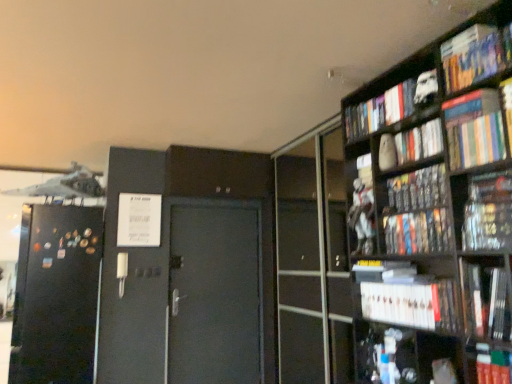
This screenshot has height=384, width=512. In order to click on hardcover book at lower right, positioned as the 11th book in top-to-bottom order in this screenshot , I will do click(x=444, y=371).

Locate an element on the screen. The height and width of the screenshot is (384, 512). metallic silver figure at upper right, the 6th book from the bottom is located at coordinates (362, 208).

Image resolution: width=512 pixels, height=384 pixels. What do you see at coordinates (417, 190) in the screenshot? I see `matte black book at upper right, the 7th book in the bottom-to-top sequence` at bounding box center [417, 190].

This screenshot has height=384, width=512. What are the coordinates of `white matte bookshelf at lower right, which is counted as the tenth book, starting from the top` in the screenshot? It's located at (406, 296).

What do you see at coordinates (406, 296) in the screenshot? The height and width of the screenshot is (384, 512). I see `white matte bookshelf at lower right, the 2th book ordered from the bottom` at bounding box center [406, 296].

The height and width of the screenshot is (384, 512). Describe the element at coordinates (475, 55) in the screenshot. I see `hardcover book at upper right, which is counted as the first book, starting from the top` at that location.

The height and width of the screenshot is (384, 512). Find the location of `white matte book at upper right, positioned as the ninth book in bottom-to-top order`. white matte book at upper right, positioned as the ninth book in bottom-to-top order is located at coordinates (410, 145).

Image resolution: width=512 pixels, height=384 pixels. Find the location of `white glossy book at lower right, the ninth book when ordered from top to bottom`. white glossy book at lower right, the ninth book when ordered from top to bottom is located at coordinates (486, 301).

From a real-world perspective, is white matte bookshelf at lower right, which is counted as the tenth book, starting from the top, above or below white matte figurine at upper right, which ranks as the tenth book in bottom-to-top order?

In terms of real-world spatial position, white matte bookshelf at lower right, which is counted as the tenth book, starting from the top, is below white matte figurine at upper right, which ranks as the tenth book in bottom-to-top order.

Is point (445, 325) closer or farther from the camera than point (406, 95)?

Point (445, 325).

Is white matte figurine at upper right, which ranks as the tenth book in bottom-to-top order, inside white matte bookshelf at lower right, which is counted as the tenth book, starting from the top?

No.

From a real-world perspective, is hardcover book at lower right, the first book positioned from the bottom, over white matte figurine at upper right, which ranks as the tenth book in bottom-to-top order?

Incorrect, from a real-world perspective, hardcover book at lower right, the first book positioned from the bottom, is lower than white matte figurine at upper right, which ranks as the tenth book in bottom-to-top order.

Can you tell me how much hardcover book at lower right, the first book positioned from the bottom, and white matte figurine at upper right, the 2th book from the top, differ in facing direction?

0.0184 degrees.

Are hardcover book at lower right, positioned as the 11th book in top-to-bottom order, and white matte figurine at upper right, which ranks as the tenth book in bottom-to-top order, beside each other?

No, hardcover book at lower right, positioned as the 11th book in top-to-bottom order, is not beside white matte figurine at upper right, which ranks as the tenth book in bottom-to-top order.

Is point (457, 379) closer or farther from the camera than point (419, 76)?

Point (457, 379) is positioned closer to the camera compared to point (419, 76).

Are hardcover book at upper right, marked as the 11th book in a bottom-to-top arrangement, and metallic silver figure at upper right, the 6th book from the bottom, far apart?

No.

Where is `the 9th book counting from the right of the metallic silver figure at upper right, the 6th book from the top`? Image resolution: width=512 pixels, height=384 pixels. the 9th book counting from the right of the metallic silver figure at upper right, the 6th book from the top is located at coordinates (475, 55).

Which object is wider, hardcover book at upper right, marked as the 11th book in a bottom-to-top arrangement, or metallic silver figure at upper right, the 6th book from the bottom?

hardcover book at upper right, marked as the 11th book in a bottom-to-top arrangement.

Is metallic silver figure at upper right, the 6th book from the bottom, in front of or behind white matte figurine at upper right, the 2th book from the top, in the image?

In the image, metallic silver figure at upper right, the 6th book from the bottom, appears behind white matte figurine at upper right, the 2th book from the top.

Considering the positions of objects metallic silver figure at upper right, the 6th book from the bottom, and white matte figurine at upper right, which ranks as the tenth book in bottom-to-top order, in the image provided, who is more to the left, metallic silver figure at upper right, the 6th book from the bottom, or white matte figurine at upper right, which ranks as the tenth book in bottom-to-top order,?

metallic silver figure at upper right, the 6th book from the bottom, is more to the left.

From the image's perspective, does metallic silver figure at upper right, the 6th book from the top, appear lower than white matte figurine at upper right, which ranks as the tenth book in bottom-to-top order?

Yes, from the image's perspective, metallic silver figure at upper right, the 6th book from the top, is beneath white matte figurine at upper right, which ranks as the tenth book in bottom-to-top order.

Can we say metallic silver figure at upper right, the 6th book from the bottom, lies outside white matte figurine at upper right, which ranks as the tenth book in bottom-to-top order?

That's correct, metallic silver figure at upper right, the 6th book from the bottom, is outside of white matte figurine at upper right, which ranks as the tenth book in bottom-to-top order.

Is matte black book at upper right, placed as the fifth book when sorted from top to bottom, wider or thinner than white matte book at upper right, which appears as the third book when viewed from the top?

Considering their sizes, matte black book at upper right, placed as the fifth book when sorted from top to bottom, looks broader than white matte book at upper right, which appears as the third book when viewed from the top.

Does point (396, 207) come behind point (402, 147)?

No, (396, 207) is closer to viewer.

From a real-world perspective, is matte black book at upper right, the 7th book in the bottom-to-top sequence, above or below white matte book at upper right, which appears as the third book when viewed from the top?

Clearly, from a real-world perspective, matte black book at upper right, the 7th book in the bottom-to-top sequence, is below white matte book at upper right, which appears as the third book when viewed from the top.

Is hardcover book at upper right, the eighth book from the top, taller or shorter than transparent glass door at right?

Clearly, hardcover book at upper right, the eighth book from the top, is shorter compared to transparent glass door at right.

Is the depth of hardcover book at upper right, the eighth book from the top, greater than that of transparent glass door at right?

No, the depth of hardcover book at upper right, the eighth book from the top, is less than that of transparent glass door at right.

Does hardcover book at upper right, the eighth book from the top, contain transparent glass door at right?

No.

Is transparent glass door at right facing away from hardcover book at upper right, the eighth book from the top?

transparent glass door at right does not have its back to hardcover book at upper right, the eighth book from the top.

Is transparent glass door at right wider than hardcover book at upper right, arranged as the 4th book when ordered from the bottom?

In fact, transparent glass door at right might be narrower than hardcover book at upper right, arranged as the 4th book when ordered from the bottom.

How many degrees apart are the facing directions of transparent glass door at right and hardcover book at upper right, the eighth book from the top?

0.0167 degrees separate the facing orientations of transparent glass door at right and hardcover book at upper right, the eighth book from the top.

Looking at this image, is transparent glass door at right not close to hardcover book at upper right, the eighth book from the top?

Yes, transparent glass door at right and hardcover book at upper right, the eighth book from the top, are quite far apart.

Where is `the 2nd book in front of the white matte bookshelf at lower right, which is counted as the tenth book, starting from the top`? The width and height of the screenshot is (512, 384). the 2nd book in front of the white matte bookshelf at lower right, which is counted as the tenth book, starting from the top is located at coordinates (390, 106).

From the image's perspective, starting from the hardcover book at lower right, positioned as the 11th book in top-to-bottom order, which book is the 9th one above? Please provide its 2D coordinates.

[(390, 106)]

When comparing their distances from hardcover books at upper right, positioned as the 4th book in top-to-bottom order, does hardcover book at upper right, the eighth book from the top, or matte black book at upper right, placed as the fifth book when sorted from top to bottom, seem further?

The object further to hardcover books at upper right, positioned as the 4th book in top-to-bottom order, is hardcover book at upper right, the eighth book from the top.

Which object lies further to the anchor point hardcover book at upper right, the eighth book from the top, hardcover book at right, arranged as the 5th book when ordered from the bottom, or transparent glass door at right?

transparent glass door at right is positioned further to the anchor hardcover book at upper right, the eighth book from the top.

Based on the photo, looking at the image, which one is located closer to white matte bookshelf at lower right, which is counted as the tenth book, starting from the top, hardcover book at upper right, arranged as the 4th book when ordered from the bottom, or metallic silver figure at upper right, the 6th book from the top?

hardcover book at upper right, arranged as the 4th book when ordered from the bottom, lies closer to white matte bookshelf at lower right, which is counted as the tenth book, starting from the top, than the other object.

Looking at the image, which one is located closer to white matte bookshelf at lower right, which is counted as the tenth book, starting from the top, hardcover book at upper right, marked as the 11th book in a bottom-to-top arrangement, or white matte book at upper right, positioned as the ninth book in bottom-to-top order?

The object closer to white matte bookshelf at lower right, which is counted as the tenth book, starting from the top, is white matte book at upper right, positioned as the ninth book in bottom-to-top order.

When comparing their distances from hardcover book at right, the seventh book from the top, does hardcover books at upper right, positioned as the 4th book in top-to-bottom order, or transparent glass door at right seem closer?

Based on the image, hardcover books at upper right, positioned as the 4th book in top-to-bottom order, appears to be nearer to hardcover book at right, the seventh book from the top.

Estimate the real-world distances between objects in this image. Which object is further from white matte figurine at upper right, which ranks as the tenth book in bottom-to-top order, black matte refrigerator at left or matte black book at upper right, placed as the fifth book when sorted from top to bottom?

Among the two, black matte refrigerator at left is located further to white matte figurine at upper right, which ranks as the tenth book in bottom-to-top order.

Estimate the real-world distances between objects in this image. Which object is closer to transparent glass door at right, hardcover books at upper right, positioned as the 4th book in top-to-bottom order, or matte black book at upper right, placed as the fifth book when sorted from top to bottom?

The object closer to transparent glass door at right is matte black book at upper right, placed as the fifth book when sorted from top to bottom.

Based on their spatial positions, is hardcover book at lower right, positioned as the 11th book in top-to-bottom order, or black matte refrigerator at left further from matte black book at upper right, the 7th book in the bottom-to-top sequence?

black matte refrigerator at left is positioned further to the anchor matte black book at upper right, the 7th book in the bottom-to-top sequence.

Where is `glass door between black matte refrigerator at left and white matte book at upper right, positioned as the ninth book in bottom-to-top order, from left to right`? This screenshot has width=512, height=384. glass door between black matte refrigerator at left and white matte book at upper right, positioned as the ninth book in bottom-to-top order, from left to right is located at coordinates (313, 260).

In order to click on book between hardcover book at upper right, the eighth book from the top, and white matte bookshelf at lower right, the 2th book ordered from the bottom, in the vertical direction in this screenshot , I will do `click(486, 301)`.

The height and width of the screenshot is (384, 512). In order to click on glass door located between black matte refrigerator at left and hardcover book at right, arranged as the 5th book when ordered from the bottom, in the left-right direction in this screenshot , I will do `click(313, 260)`.

Find the location of `glass door between hardcover book at upper right, arranged as the 4th book when ordered from the bottom, and hardcover book at lower right, positioned as the 11th book in top-to-bottom order, in the up-down direction`. glass door between hardcover book at upper right, arranged as the 4th book when ordered from the bottom, and hardcover book at lower right, positioned as the 11th book in top-to-bottom order, in the up-down direction is located at coordinates (313, 260).